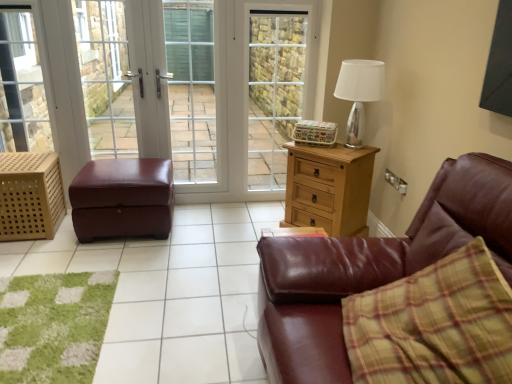
At what (x,y) coordinates should I click in order to perform the action: click on blank space situated above light brown wooden chest of drawers at center right (from a real-world perspective). Please return your answer as a coordinate pair (x, y). The image size is (512, 384). Looking at the image, I should click on (327, 146).